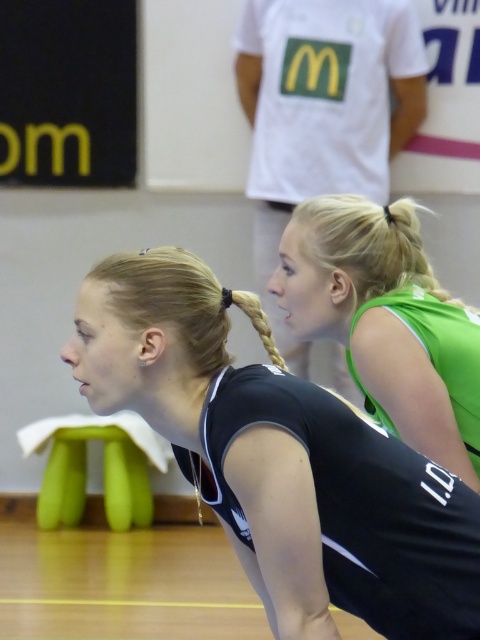
You are a sports photographer trying to capture the action in this volleyball game. You notice the black matte uniform at center and the green jersey at upper center. Which athlete should you focus on if you want to photograph someone who takes up more visual space in the frame?

The green jersey at upper center occupies more visual space in the frame compared to the black matte uniform at center, so focusing on the athlete in the green jersey at upper center would be better for capturing someone who takes up more visual space.

You are a sports photographer standing at the camera position. You want to take a photo of the volleyball player wearing the black sleeveless sports jersey with white accents and the number 10. The player is at point (x=272, y=572). You have a lens that can focus up to 2 meters. Will your lens be able to focus on the player?

The distance between the camera and the point (x=272, y=572) is 1.98 meters. Since the lens can focus up to 2 meters, the lens will be able to focus on the player at point (x=272, y=572).

You are a sports photographer trying to capture a closeup of both the green jersey at upper center and the green jersey at upper right. Since you want both to be clearly visible in your shot, which one should you focus on first to ensure the larger jersey is sharp?

The green jersey at upper center is bigger than the green jersey at upper right, so you should focus on the green jersey at upper center first to ensure it is sharp before adjusting for the smaller one.